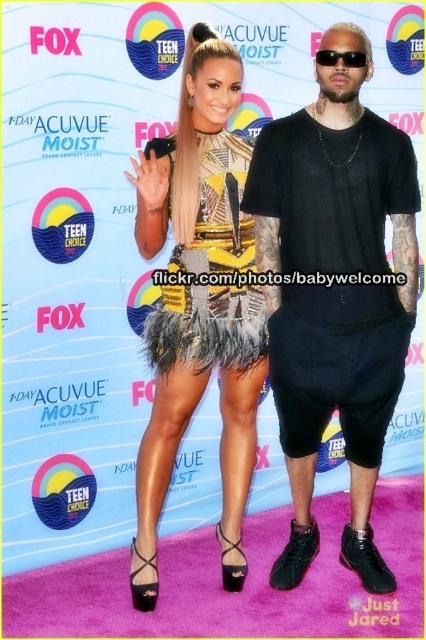
You are a photographer at the Teen Choice Awards. You need to capture a photo of both the feathered dress at center and the feathered yellow dress at center. Which dress should you focus on first if you want to include both in your frame without moving the camera?

The feathered dress at center should be focused on first since it is positioned on the left side of the feathered yellow dress at center, allowing the photographer to frame both dresses by starting from the left and capturing the entire arrangement.

You are a photographer at the Teen Choice Awards and need to position two models wearing the feathered dress at center and the feathered yellow dress at center for a group photo. Which dress should you place closer to the edge to avoid overcrowding the frame?

The feathered yellow dress at center should be placed closer to the edge since the feathered dress at center might be wider and thus requires more space to avoid overcrowding the frame.